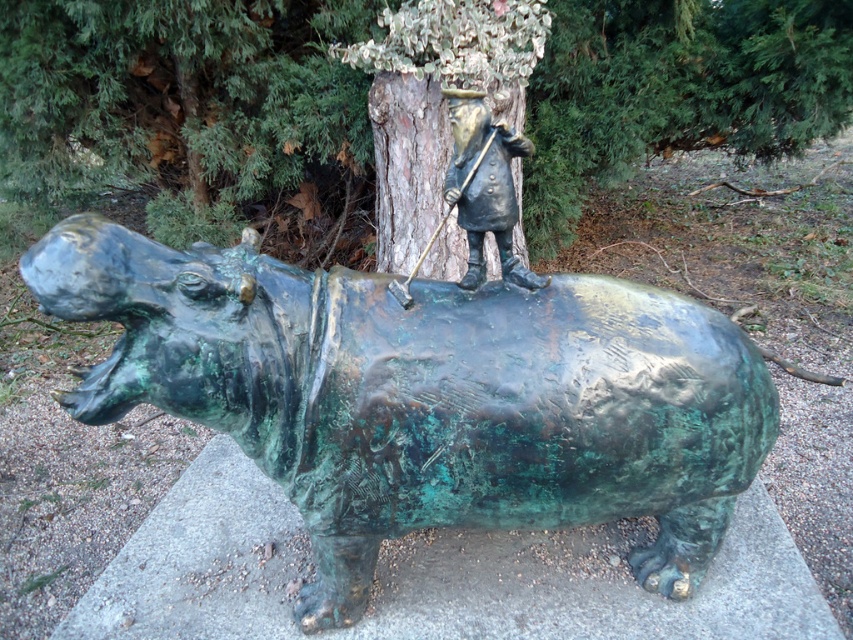
Question: Which point is farther to the camera?

Choices:
 (A) green patina hippo at center
 (B) bronze statue at center

Answer: (B)

Question: Estimate the real-world distances between objects in this image. Which object is farther from the green textured tree trunk at center?

Choices:
 (A) green patina hippo at center
 (B) bronze statue at center

Answer: (B)

Question: Can you confirm if green patina hippo at center is positioned to the right of bronze statue at center?

Choices:
 (A) no
 (B) yes

Answer: (A)

Question: Which point is farther from the camera taking this photo?

Choices:
 (A) (x=338, y=406)
 (B) (x=618, y=100)
 (C) (x=496, y=157)

Answer: (B)

Question: Is green patina hippo at center closer to the viewer compared to green textured tree trunk at center?

Choices:
 (A) yes
 (B) no

Answer: (A)

Question: Does green patina hippo at center appear on the right side of bronze statue at center?

Choices:
 (A) no
 (B) yes

Answer: (A)